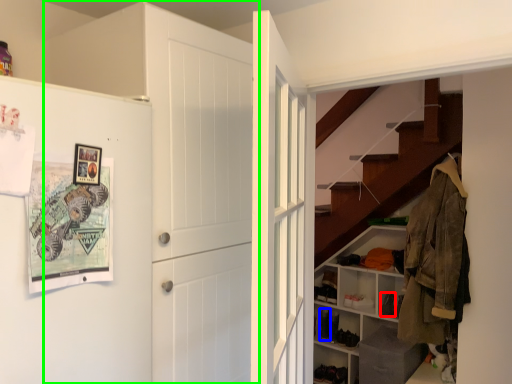
Question: Considering the real-world distances, which object is closest to shoe (highlighted by a red box)? shoe (highlighted by a blue box) or door (highlighted by a green box).

Choices:
 (A) shoe
 (B) door

Answer: (A)